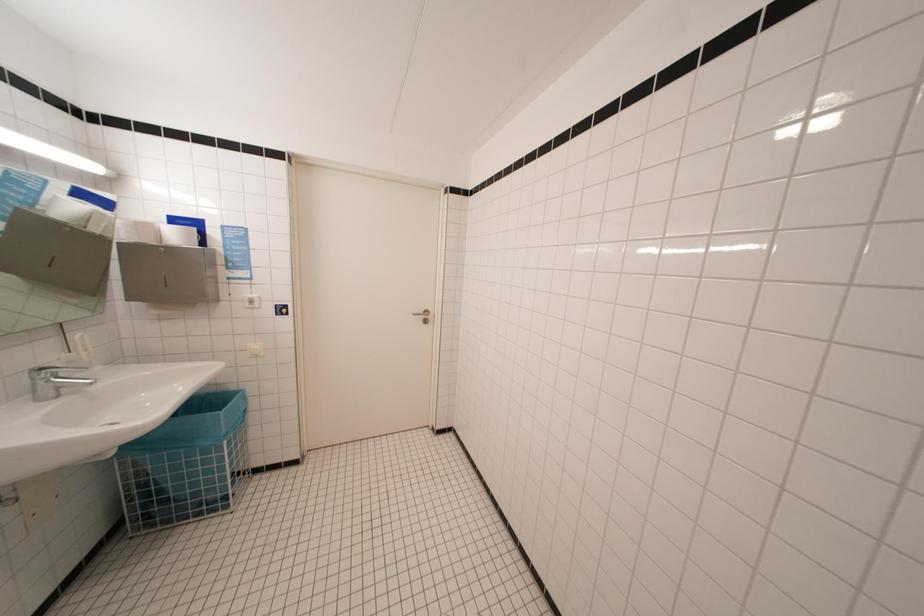
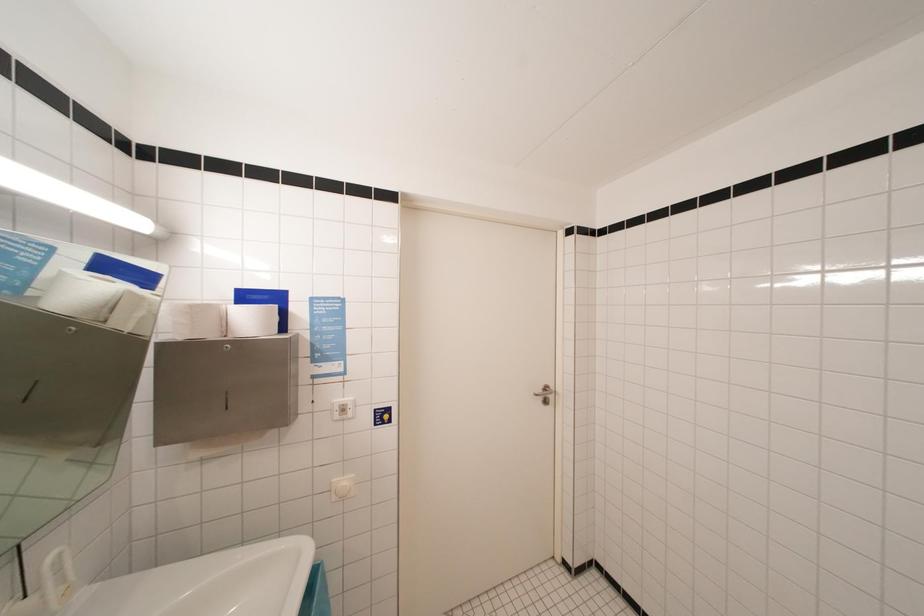
Based on the photo, the images are taken continuously from a first-person perspective. In which direction are you moving?

The cameraman moved toward left, forward.